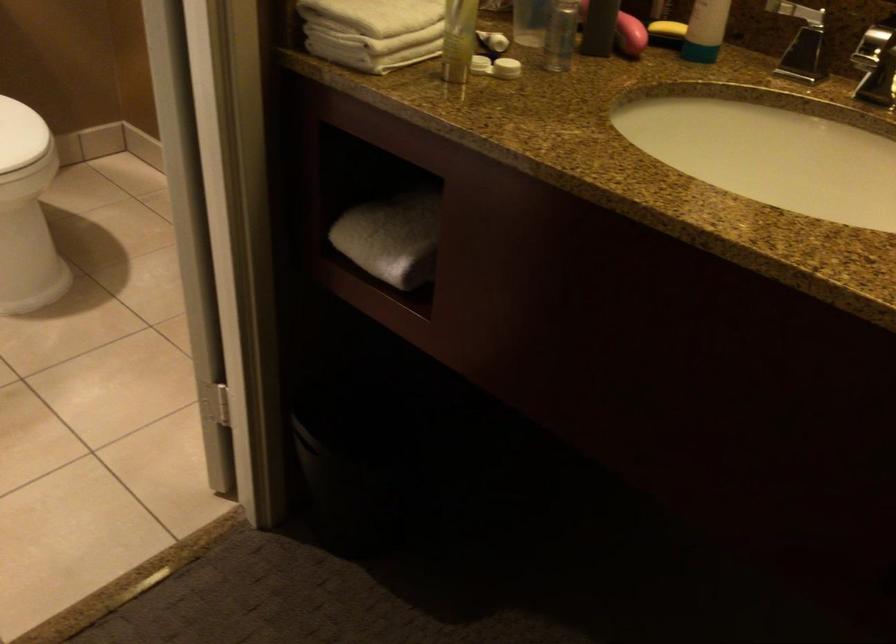
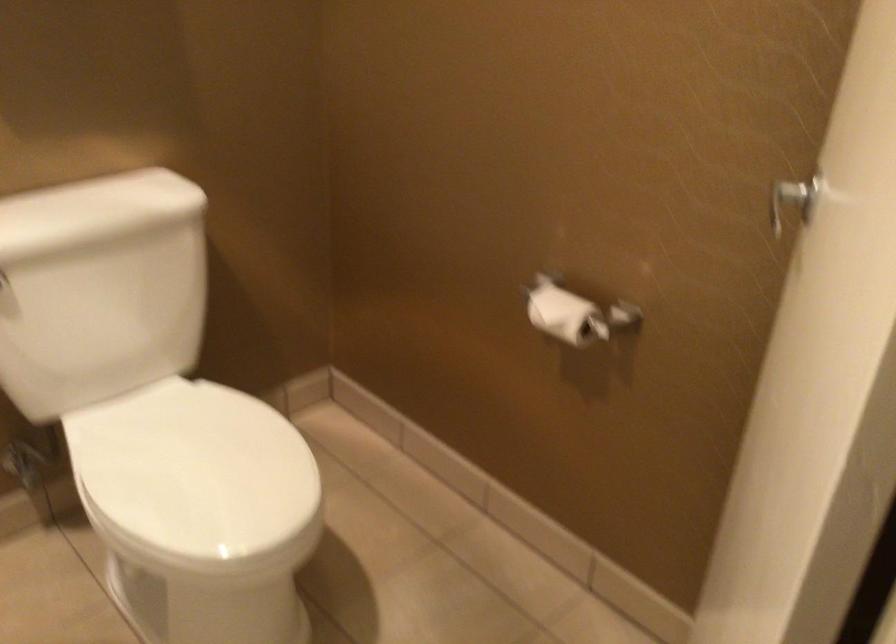
Consider the image. In a continuous first-person perspective shot, in which direction is the camera moving?

The cameraman moved toward left, forward.